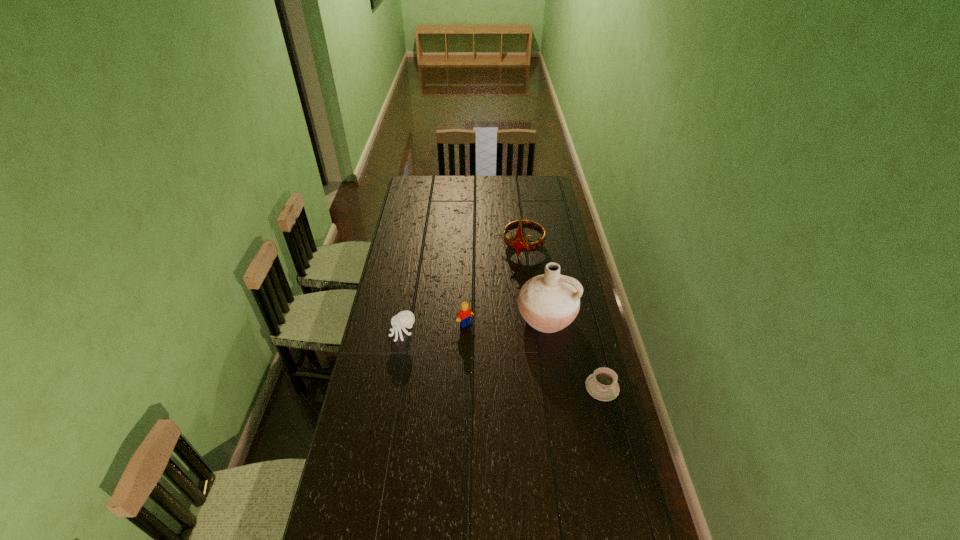
In order to click on blank region between the leftmost object and the Lego in this screenshot , I will do `click(434, 329)`.

At what (x,y) coordinates should I click in order to perform the action: click on free area in between the teacup and the pottery. Please return your answer as a coordinate pair (x, y). Looking at the image, I should click on (574, 353).

Image resolution: width=960 pixels, height=540 pixels. Find the location of `empty space that is in between the fourth shortest object and the fourth object from right to left`. empty space that is in between the fourth shortest object and the fourth object from right to left is located at coordinates (494, 285).

Where is `empty location between the pottery and the leftmost object`? empty location between the pottery and the leftmost object is located at coordinates (475, 326).

You are a GUI agent. You are given a task and a screenshot of the screen. Output one action in this format:
    pyautogui.click(x=<x>, y=<y>)
    Task: Click on the free space between the second tallest object and the leftmost object
    This screenshot has width=960, height=540.
    Given the screenshot: What is the action you would take?
    pyautogui.click(x=464, y=290)

Choose which object is the third nearest neighbor to the tiara. Please provide its 2D coordinates. Your answer should be formatted as a tuple, i.e. [(x, y)], where the tuple contains the x and y coordinates of a point satisfying the conditions above.

[(405, 319)]

Locate an element on the screen. The image size is (960, 540). object that is the closest to the shortest object is located at coordinates (550, 302).

Where is `free space that satisfies the following two spatial constraints: 1. on the front side of the shortest object; 2. on the handle side of the pottery`? This screenshot has height=540, width=960. free space that satisfies the following two spatial constraints: 1. on the front side of the shortest object; 2. on the handle side of the pottery is located at coordinates (557, 387).

Locate an element on the screen. This screenshot has width=960, height=540. free location that satisfies the following two spatial constraints: 1. on the back side of the tiara; 2. on the right side of the second object from left to right is located at coordinates (468, 246).